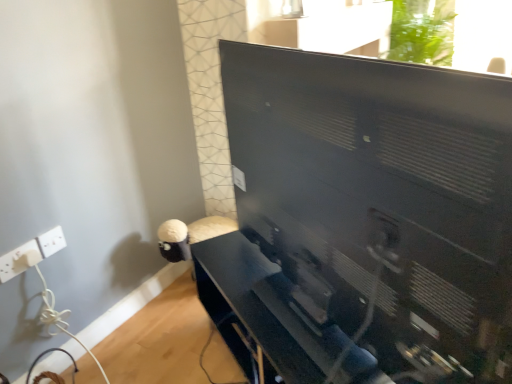
Question: Can matte black tv stand at center be found inside black matte computer monitor at center?

Choices:
 (A) yes
 (B) no

Answer: (B)

Question: Is the position of black matte computer monitor at center less distant than that of matte black tv stand at center?

Choices:
 (A) yes
 (B) no

Answer: (A)

Question: Considering the relative sizes of black matte computer monitor at center and matte black tv stand at center in the image provided, is black matte computer monitor at center bigger than matte black tv stand at center?

Choices:
 (A) yes
 (B) no

Answer: (A)

Question: Is matte black tv stand at center at the back of black matte computer monitor at center?

Choices:
 (A) no
 (B) yes

Answer: (A)

Question: Considering the relative positions of black matte computer monitor at center and matte black tv stand at center in the image provided, is black matte computer monitor at center to the right of matte black tv stand at center from the viewer's perspective?

Choices:
 (A) no
 (B) yes

Answer: (B)

Question: From a real-world perspective, is black matte computer monitor at center below matte black tv stand at center?

Choices:
 (A) yes
 (B) no

Answer: (B)

Question: From the image's perspective, is matte black tv stand at center beneath white plastic electric outlet at lower left, the 1th electric outlet when ordered from left to right?

Choices:
 (A) yes
 (B) no

Answer: (A)

Question: Is matte black tv stand at center shorter than white plastic electric outlet at lower left, the 1th electric outlet when ordered from left to right?

Choices:
 (A) no
 (B) yes

Answer: (A)

Question: Is matte black tv stand at center not inside white plastic electric outlet at lower left, the 1th electric outlet when ordered from left to right?

Choices:
 (A) yes
 (B) no

Answer: (A)

Question: Is matte black tv stand at center at the left side of white plastic electric outlet at lower left, the 1th electric outlet when ordered from left to right?

Choices:
 (A) no
 (B) yes

Answer: (A)

Question: Is matte black tv stand at center far away from white plastic electric outlet at lower left, the 1th electric outlet when ordered from left to right?

Choices:
 (A) no
 (B) yes

Answer: (A)

Question: Considering the relative sizes of matte black tv stand at center and white plastic electric outlet at lower left, the 1th electric outlet when ordered from left to right, in the image provided, is matte black tv stand at center wider than white plastic electric outlet at lower left, the 1th electric outlet when ordered from left to right,?

Choices:
 (A) no
 (B) yes

Answer: (B)

Question: Would you say white plastic electric outlet at lower left, the 1th electric outlet viewed from the right, is outside black matte computer monitor at center?

Choices:
 (A) yes
 (B) no

Answer: (A)